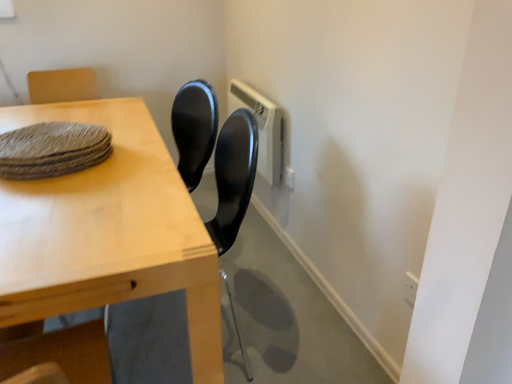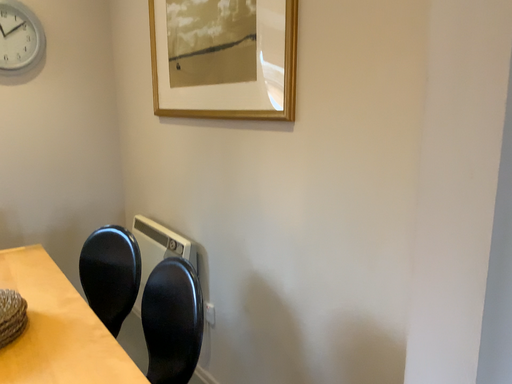
Question: Which way did the camera rotate in the video?

Choices:
 (A) rotated right
 (B) rotated left

Answer: (A)